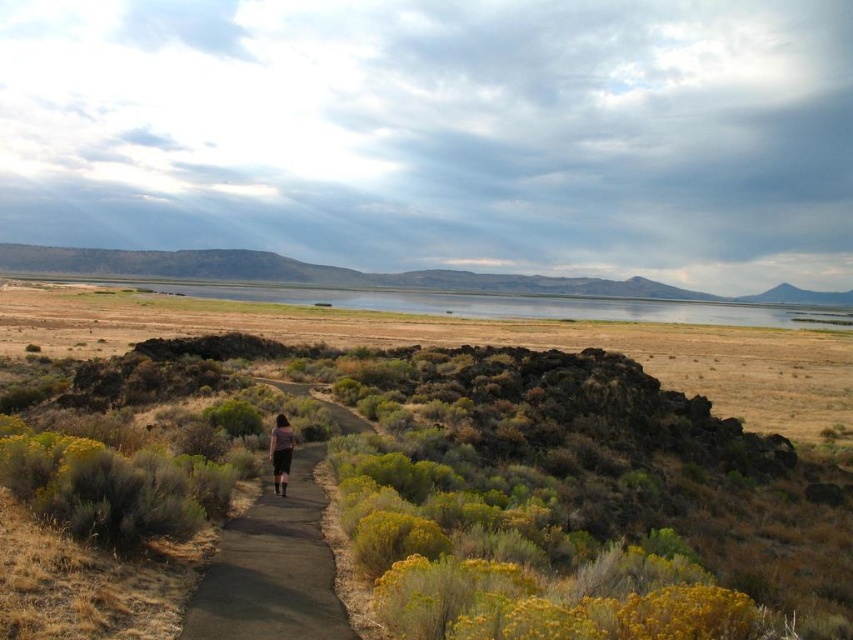
You are a photographer trying to capture the dark gray fabric skirt at center in your shot. However, the green shrubs at center are blocking your view. Can you move the shrubs to get a clear shot of the skirt?

The green shrubs at center is much taller than dark gray fabric skirt at center, so you cannot move the shrubs because they are taller and likely more established, making them harder to move compared to the skirt.

You are a hiker trying to follow the path through the shrub area. You see the black asphalt path at center and the dark gray fabric skirt at center. Which object is larger in size?

The black asphalt path at center is bigger than dark gray fabric skirt at center.

You are standing at the point marked by the coordinates point (469, 470) in the image, which is located at green shrubs at center. You want to walk to the nearest paved path that curves gently to the left. Which direction should you head to reach the path?

The point marked by the coordinates point (469, 470) is located at green shrubs at center. Since the paved path curves gently to the left in the foreground, you should head towards the direction where the path curves to the left to reach it.